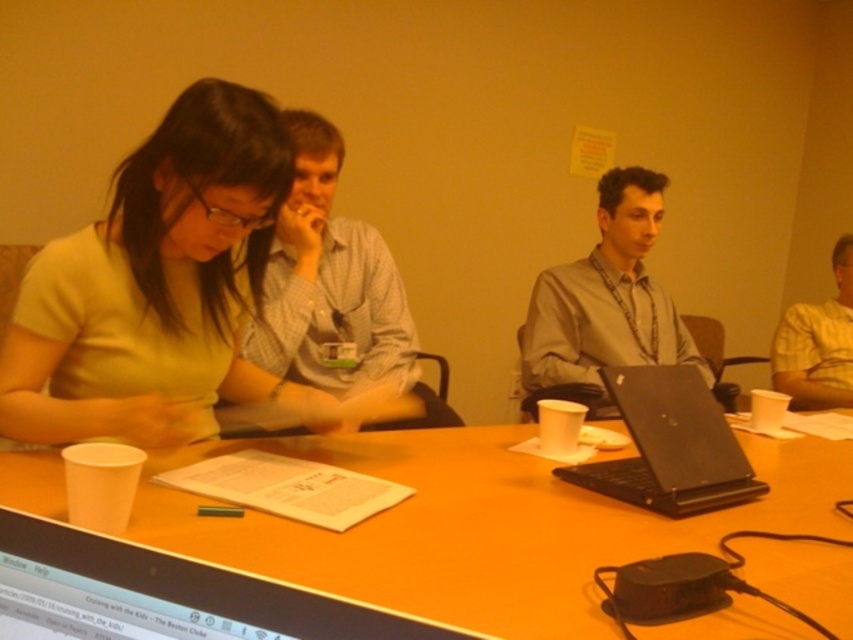
Is matte yellow shirt at center wider than matte gray shirt at center?

In fact, matte yellow shirt at center might be narrower than matte gray shirt at center.

Can you confirm if matte yellow shirt at center is smaller than matte gray shirt at center?

Yes.

Who is more forward, (51, 305) or (659, 196)?

Point (51, 305)

Locate an element on the screen. The width and height of the screenshot is (853, 640). matte yellow shirt at center is located at coordinates [x=154, y=285].

Based on the photo, which of these two, black matte laptop at center or yellow checkered shirt at right, stands shorter?

black matte laptop at center

Looking at this image, who is lower down, black matte laptop at center or yellow checkered shirt at right?

black matte laptop at center is below.

Identify the location of black matte laptop at center. The width and height of the screenshot is (853, 640). (669, 445).

The width and height of the screenshot is (853, 640). I want to click on black matte laptop at center, so click(669, 445).

Between wooden table at center and black matte laptop at center, which one appears on the right side from the viewer's perspective?

black matte laptop at center

Between wooden table at center and black matte laptop at center, which one is positioned higher?

Positioned higher is black matte laptop at center.

Between point (485, 556) and point (657, 426), which one is positioned behind?

The point (657, 426) is more distant.

I want to click on wooden table at center, so click(479, 525).